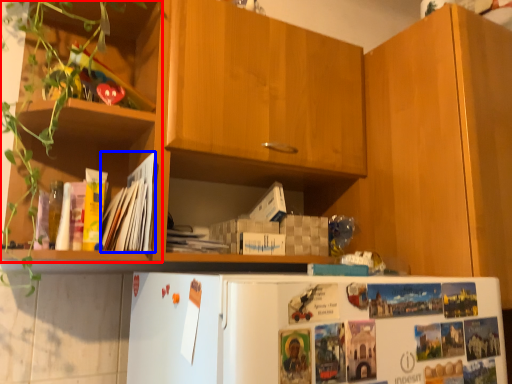
Question: Which point is closer to the camera, shelf (highlighted by a red box) or magazine (highlighted by a blue box)?

Choices:
 (A) shelf
 (B) magazine

Answer: (A)